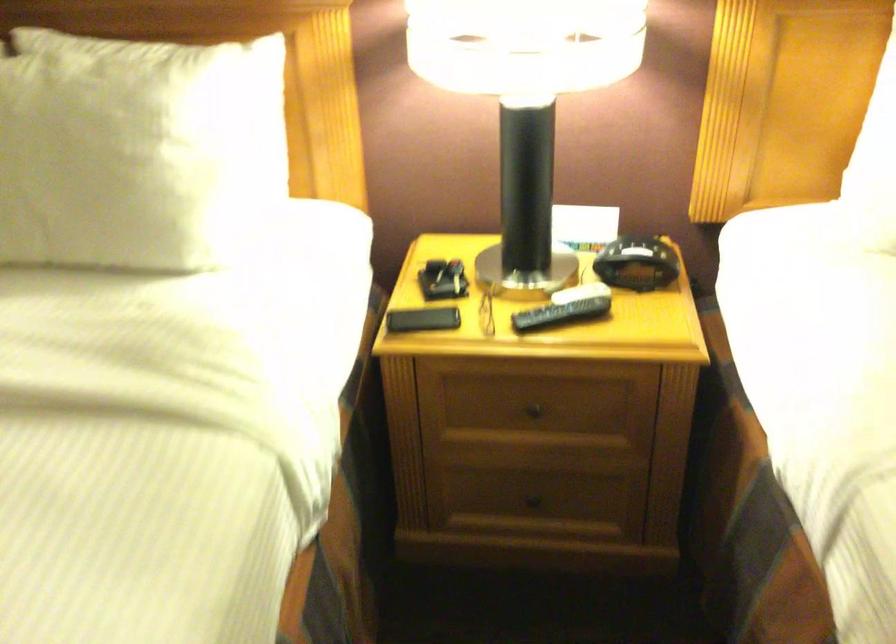
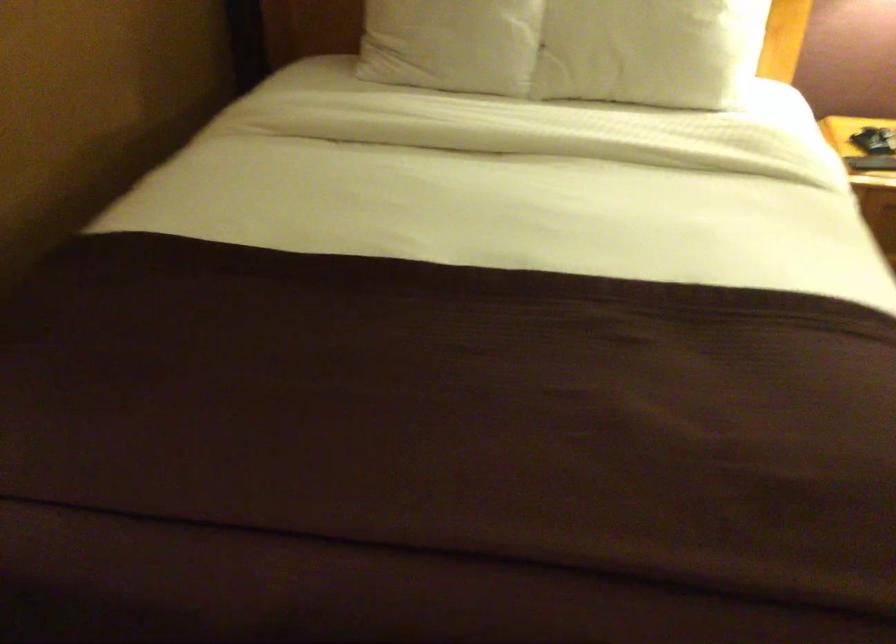
The images are taken continuously from a first-person perspective. In which direction are you moving?

The cameraman walked toward left, backward.